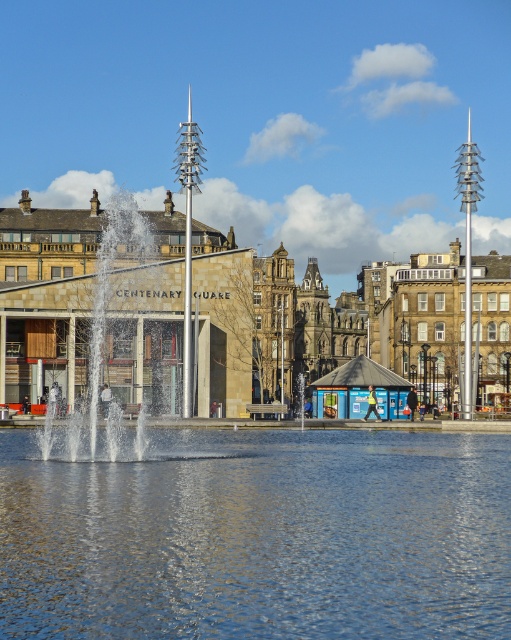
Question: Is clear water at center below metallic fountain at center?

Choices:
 (A) yes
 (B) no

Answer: (A)

Question: Which object is closer to the camera taking this photo?

Choices:
 (A) clear water at center
 (B) polished stone fountain at center
 (C) metallic fountain at center

Answer: (A)

Question: Which is nearer to the clear water at center?

Choices:
 (A) metallic fountain at center
 (B) polished stone fountain at center

Answer: (A)

Question: Is clear water at center positioned before metallic fountain at center?

Choices:
 (A) no
 (B) yes

Answer: (B)

Question: Does clear water at center have a larger size compared to metallic fountain at center?

Choices:
 (A) no
 (B) yes

Answer: (A)

Question: Estimate the real-world distances between objects in this image. Which object is farther from the clear water at center?

Choices:
 (A) polished stone fountain at center
 (B) metallic fountain at center

Answer: (A)